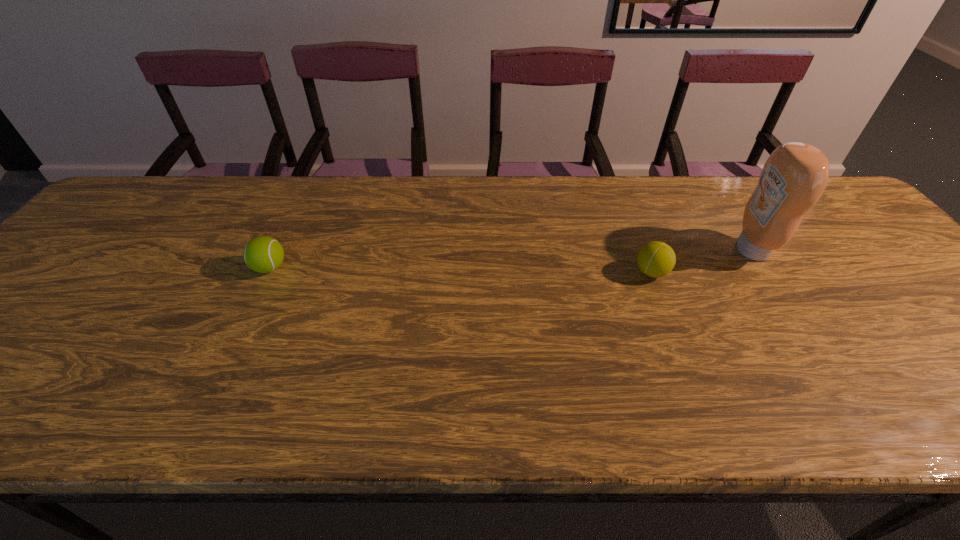
Identify the location of blank space at the near edge of the desktop. (784, 411).

Where is `vacant area at the left edge`? The width and height of the screenshot is (960, 540). vacant area at the left edge is located at coordinates (121, 261).

You are a GUI agent. You are given a task and a screenshot of the screen. Output one action in this format:
    pyautogui.click(x=<x>, y=<y>)
    Task: Click on the vacant region at the far right corner of the desktop
    
    Given the screenshot: What is the action you would take?
    pyautogui.click(x=827, y=193)

Where is `unoccupied area between the condiment and the leftmost object`? The image size is (960, 540). unoccupied area between the condiment and the leftmost object is located at coordinates (511, 259).

The height and width of the screenshot is (540, 960). Find the location of `free space between the right tennis ball and the rightmost object`. free space between the right tennis ball and the rightmost object is located at coordinates (702, 261).

This screenshot has width=960, height=540. In order to click on vacant point located between the left tennis ball and the second object from left to right in this screenshot , I will do `click(461, 270)`.

Locate an element on the screen. The height and width of the screenshot is (540, 960). vacant region between the second object from left to right and the leftmost object is located at coordinates (461, 270).

Where is `unoccupied area between the leftmost object and the right tennis ball`? This screenshot has width=960, height=540. unoccupied area between the leftmost object and the right tennis ball is located at coordinates (461, 270).

You are a GUI agent. You are given a task and a screenshot of the screen. Output one action in this format:
    pyautogui.click(x=<x>, y=<y>)
    Task: Click on the empty location between the rightmost object and the leftmost object
    The height and width of the screenshot is (540, 960).
    Given the screenshot: What is the action you would take?
    pyautogui.click(x=511, y=259)

This screenshot has width=960, height=540. I want to click on blank region between the condiment and the left tennis ball, so click(x=511, y=259).